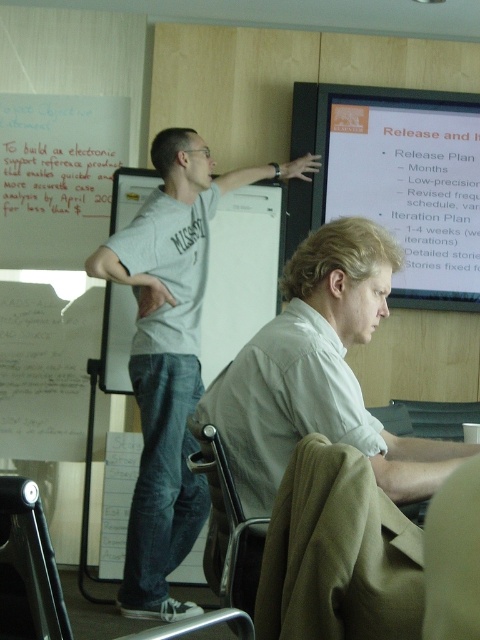
Is point (175, 512) farther from camera compared to point (81, 196)?

That is False.

Measure the distance between gray cotton shirt at upper center and white paper at upper left.

33.21 inches

Is point (187, 554) farther from viewer compared to point (38, 184)?

No.

Locate an element on the screen. Image resolution: width=480 pixels, height=640 pixels. gray cotton shirt at upper center is located at coordinates (169, 355).

Does white glossy projector screen at upper center lie in front of white paper at upper left?

Yes, white glossy projector screen at upper center is in front of white paper at upper left.

Looking at this image, who is positioned more to the left, white glossy projector screen at upper center or white paper at upper left?

white paper at upper left

Find the location of a particular element. The image size is (480, 640). white glossy projector screen at upper center is located at coordinates (408, 182).

Is gray cotton shirt at upper center thinner than white glossy projector screen at upper center?

In fact, gray cotton shirt at upper center might be wider than white glossy projector screen at upper center.

Does gray cotton shirt at upper center appear on the left side of white glossy projector screen at upper center?

Indeed, gray cotton shirt at upper center is positioned on the left side of white glossy projector screen at upper center.

Is point (192, 148) less distant than point (444, 260)?

Yes, it is.

Locate an element on the screen. gray cotton shirt at upper center is located at coordinates (169, 355).